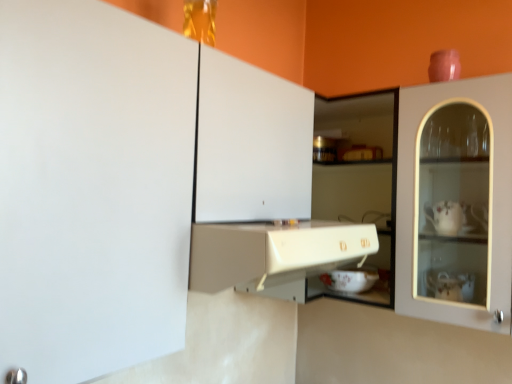
Question: From the image's perspective, is matte white cabinet at center, placed as the 2th cabinetry when sorted from top to bottom, located above or below white glossy bowl at center?

Choices:
 (A) below
 (B) above

Answer: (B)

Question: Is matte white cabinet at center, placed as the 2th cabinetry when sorted from top to bottom, taller or shorter than white glossy bowl at center?

Choices:
 (A) tall
 (B) short

Answer: (A)

Question: Considering the real-world distances, which object is farthest from the matte white cabinet at center, arranged as the first cabinetry when ordered from the bottom?

Choices:
 (A) white matte cabinet at upper left, acting as the 1th cabinetry starting from the top
 (B) white glossy bowl at center

Answer: (B)

Question: Which object is the farthest from the matte white cabinet at center, arranged as the first cabinetry when ordered from the bottom?

Choices:
 (A) white glossy bowl at center
 (B) white matte cabinet at upper left, acting as the 1th cabinetry starting from the top

Answer: (A)